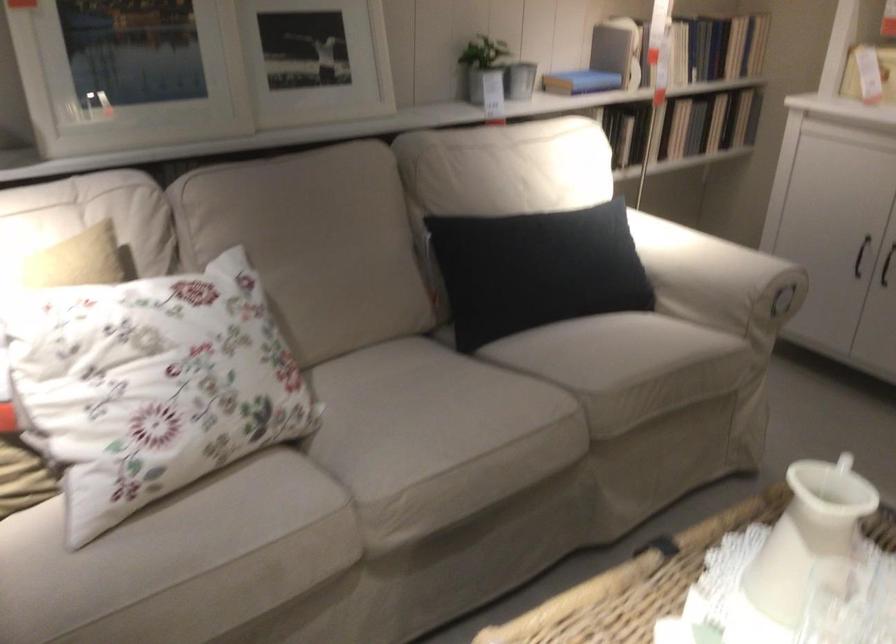
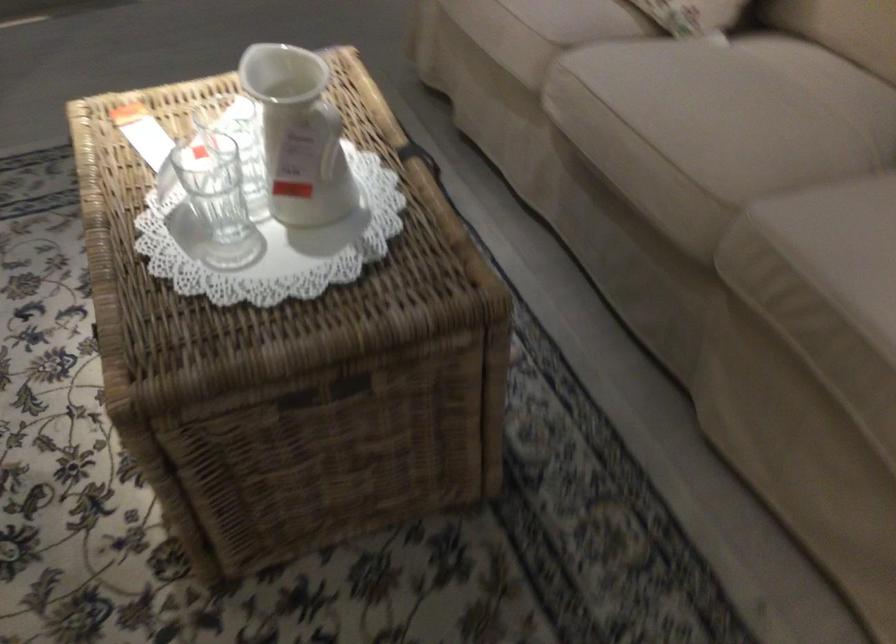
The point at (533, 420) is marked in the first image. Where is the corresponding point in the second image?

(704, 167)